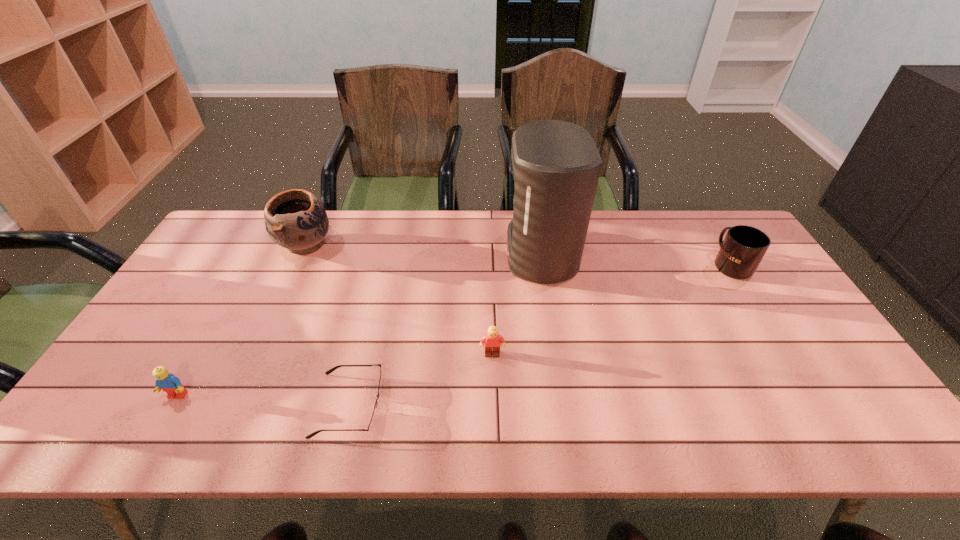
Find the location of a particular element. Image resolution: width=960 pixels, height=540 pixels. the second object from right to left is located at coordinates (556, 165).

Find the location of a particular element. the tallest object is located at coordinates (556, 165).

The image size is (960, 540). I want to click on pottery, so click(295, 219).

Locate an element on the screen. the second tallest object is located at coordinates click(x=295, y=219).

I want to click on the rightmost object, so point(743,248).

Locate an element on the screen. This screenshot has height=540, width=960. the fourth shortest object is located at coordinates (743, 248).

Where is `the right Lego`? the right Lego is located at coordinates (492, 339).

This screenshot has width=960, height=540. I want to click on the third object from right to left, so click(x=492, y=339).

Identify the location of the left Lego. The width and height of the screenshot is (960, 540). (165, 381).

In order to click on the leftmost object in this screenshot , I will do `click(165, 381)`.